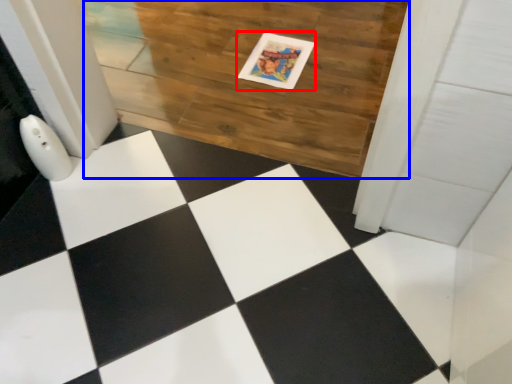
Question: Among these objects, which one is nearest to the camera, postcard (highlighted by a red box) or hardwood (highlighted by a blue box)?

Choices:
 (A) postcard
 (B) hardwood

Answer: (B)